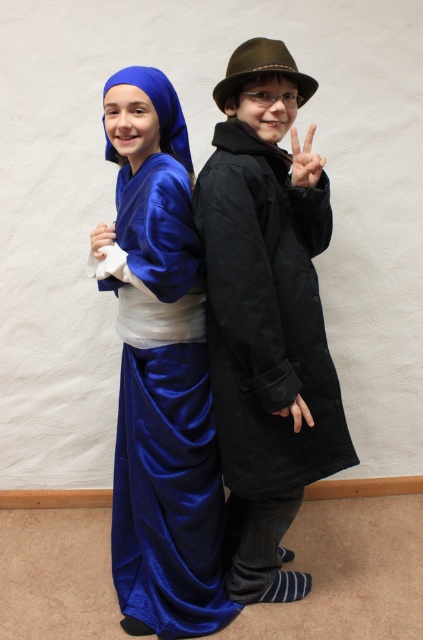
Who is positioned more to the right, matte black hand at upper center or white matte hand at center?

Positioned to the right is matte black hand at upper center.

Who is shorter, matte black hand at upper center or white matte hand at center?

Standing shorter between the two is white matte hand at center.

Is point (296, 176) farther from camera compared to point (96, 232)?

That is False.

Identify the location of matte black hand at upper center. The width and height of the screenshot is (423, 640). (304, 161).

Can you confirm if satin blue robe at center is positioned below white matte hand at center?

Yes.

This screenshot has width=423, height=640. Find the location of `satin blue robe at center`. satin blue robe at center is located at coordinates (266, 321).

In order to click on satin blue robe at center in this screenshot , I will do `click(266, 321)`.

Does satin blue robe at center appear on the left side of matte black hand at upper center?

Correct, you'll find satin blue robe at center to the left of matte black hand at upper center.

Does satin blue robe at center lie in front of matte black hand at upper center?

Yes, satin blue robe at center is closer to the viewer.

Image resolution: width=423 pixels, height=640 pixels. In order to click on satin blue robe at center in this screenshot , I will do `click(266, 321)`.